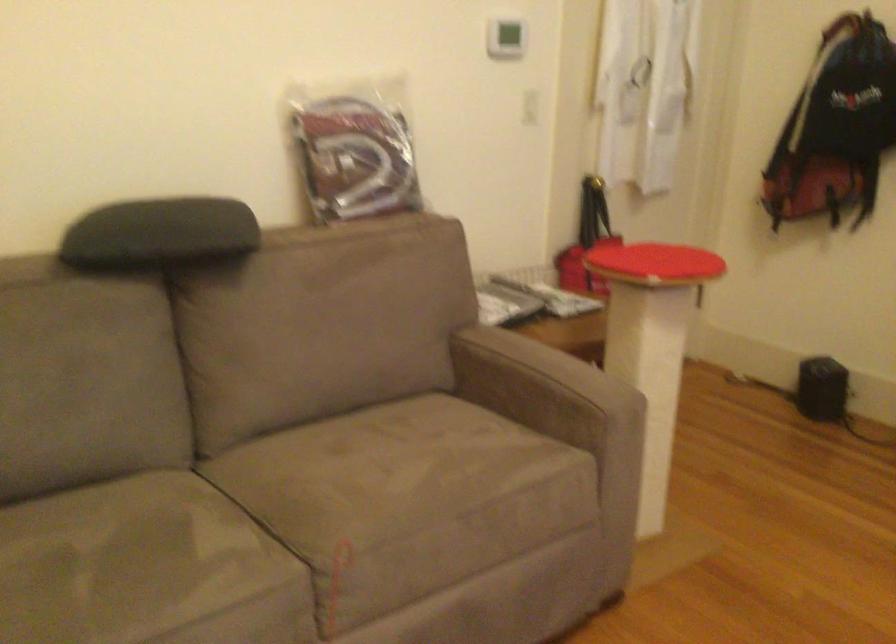
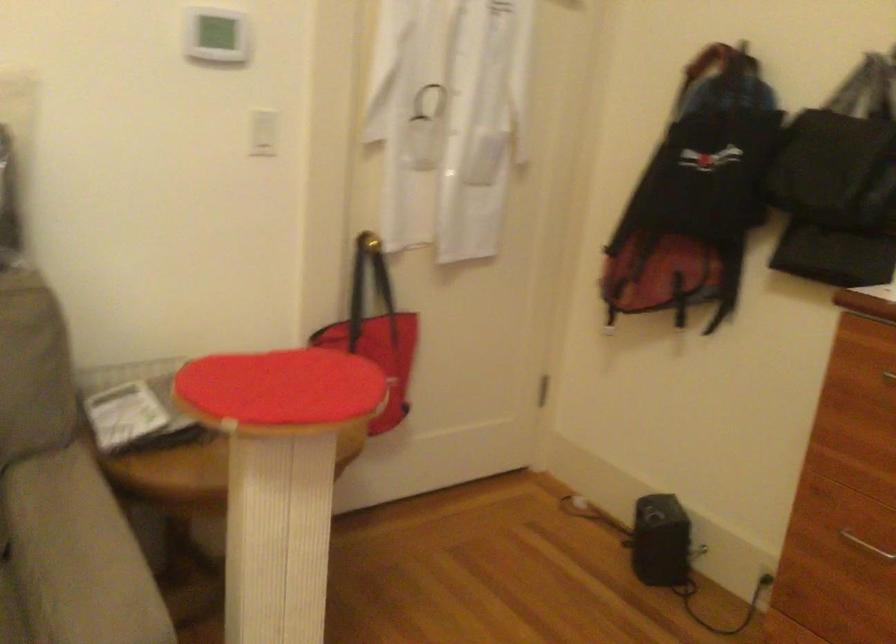
Question: How did the camera likely rotate?

Choices:
 (A) Left
 (B) Right
 (C) Up
 (D) Down

Answer: (C)